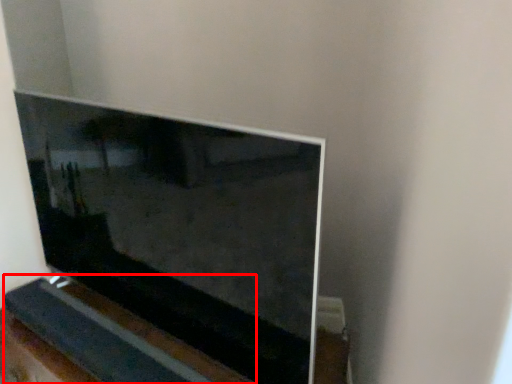
Question: Considering the relative positions of ledge (annotated by the red box) and television in the image provided, where is ledge (annotated by the red box) located with respect to the staircase?

Choices:
 (A) right
 (B) left

Answer: (B)